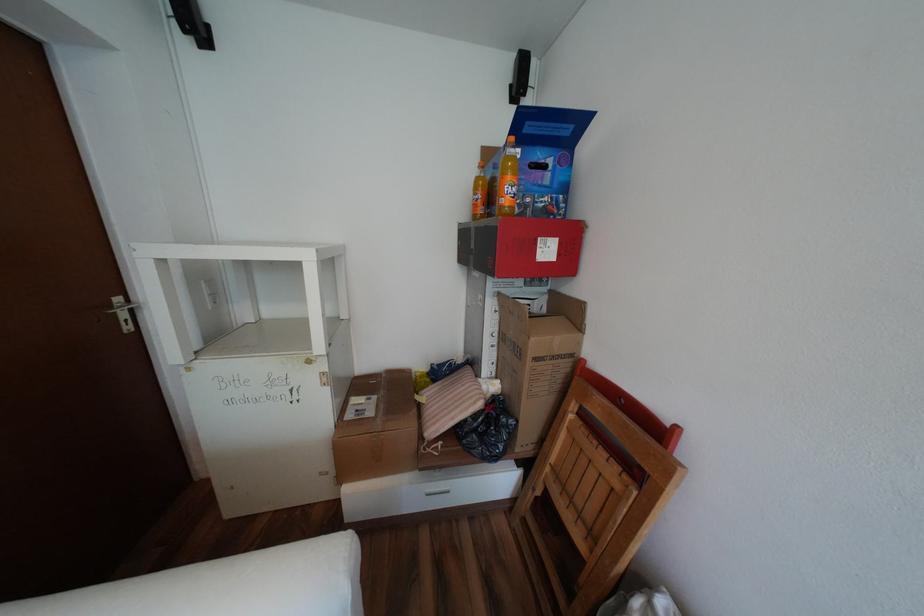
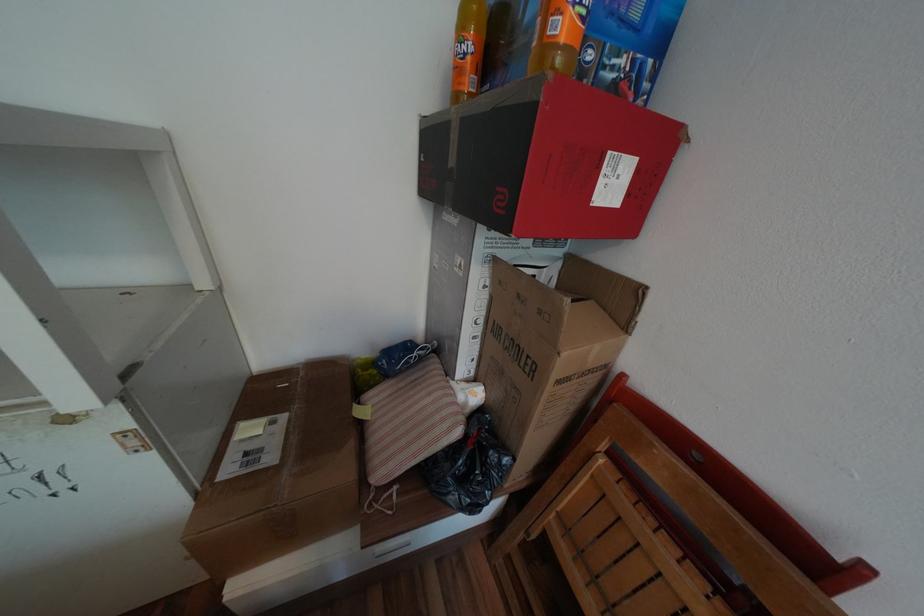
Locate, in the second image, the point that corresponds to (x=383, y=397) in the first image.

(293, 416)